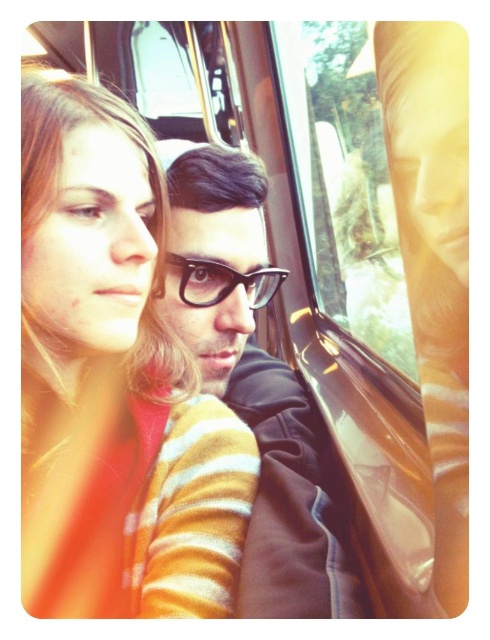
Question: Estimate the real-world distances between objects in this image. Which object is farther from the transparent glass train window at upper center?

Choices:
 (A) black matte glasses at center
 (B) black plastic glasses at center
 (C) matte orange sweater at left

Answer: (C)

Question: Is black matte glasses at center wider than transparent glass train window at upper center?

Choices:
 (A) no
 (B) yes

Answer: (B)

Question: Among these points, which one is nearest to the camera?

Choices:
 (A) (349, 113)
 (B) (112, 240)
 (C) (304, 461)
 (D) (204, 282)

Answer: (B)

Question: Considering the real-world distances, which object is farthest from the transparent glass train window at upper center?

Choices:
 (A) matte orange sweater at left
 (B) black matte glasses at center
 (C) black plastic glasses at center

Answer: (A)

Question: Is black matte glasses at center smaller than black plastic glasses at center?

Choices:
 (A) no
 (B) yes

Answer: (A)

Question: Is black matte glasses at center thinner than transparent glass train window at upper center?

Choices:
 (A) no
 (B) yes

Answer: (A)